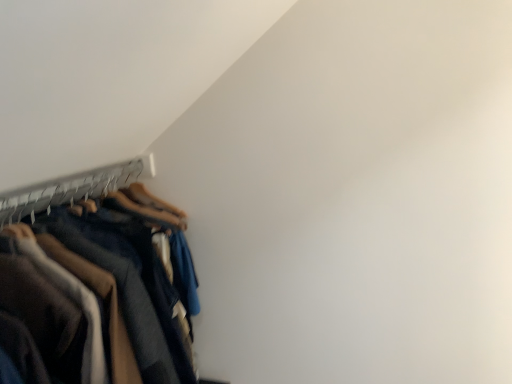
At what (x,y) coordinates should I click in order to perform the action: click on dark blue cotton trousers at left. Please return your answer as a coordinate pair (x, y). Looking at the image, I should click on (93, 303).

The height and width of the screenshot is (384, 512). What do you see at coordinates (93, 303) in the screenshot?
I see `dark blue cotton trousers at left` at bounding box center [93, 303].

What do you see at coordinates (70, 189) in the screenshot?
I see `wooden hanger at left` at bounding box center [70, 189].

Locate an element on the screen. wooden hanger at left is located at coordinates (70, 189).

The image size is (512, 384). What are the coordinates of `dark blue cotton trousers at left` in the screenshot? It's located at (93, 303).

Which is more to the right, wooden hanger at left or dark blue cotton trousers at left?

Positioned to the right is dark blue cotton trousers at left.

Is wooden hanger at left positioned before dark blue cotton trousers at left?

No, wooden hanger at left is further to the viewer.

Does point (79, 175) come closer to viewer compared to point (89, 226)?

No.

From the image's perspective, is wooden hanger at left located above dark blue cotton trousers at left?

Correct, wooden hanger at left appears higher than dark blue cotton trousers at left in the image.

From a real-world perspective, between wooden hanger at left and dark blue cotton trousers at left, who is vertically higher?

wooden hanger at left, from a real-world perspective.

Looking at their sizes, would you say wooden hanger at left is wider or thinner than dark blue cotton trousers at left?

Considering their sizes, wooden hanger at left looks slimmer than dark blue cotton trousers at left.

Who is shorter, wooden hanger at left or dark blue cotton trousers at left?

With less height is wooden hanger at left.

Which of these two, wooden hanger at left or dark blue cotton trousers at left, is smaller?

wooden hanger at left.

Is wooden hanger at left completely or partially outside of dark blue cotton trousers at left?

Actually, wooden hanger at left is at least partially inside dark blue cotton trousers at left.

Is wooden hanger at left far from dark blue cotton trousers at left?

wooden hanger at left is actually quite close to dark blue cotton trousers at left.

Is wooden hanger at left positioned with its back to dark blue cotton trousers at left?

Yes, wooden hanger at left is facing away from dark blue cotton trousers at left.

Where is `hanger behind the dark blue cotton trousers at left`? hanger behind the dark blue cotton trousers at left is located at coordinates (70, 189).

Considering the positions of objects dark blue cotton trousers at left and wooden hanger at left in the image provided, who is more to the right, dark blue cotton trousers at left or wooden hanger at left?

dark blue cotton trousers at left.

Which object is closer to the camera taking this photo, dark blue cotton trousers at left or wooden hanger at left?

dark blue cotton trousers at left is more forward.

Does point (195, 380) lie in front of point (58, 183)?

That is False.

From the image's perspective, is dark blue cotton trousers at left on wooden hanger at left?

No, from the image's perspective, dark blue cotton trousers at left is not on top of wooden hanger at left.

Consider the image. From a real-world perspective, is dark blue cotton trousers at left on wooden hanger at left?

No, from a real-world perspective, dark blue cotton trousers at left is not above wooden hanger at left.

Consider the image. Which object is wider, dark blue cotton trousers at left or wooden hanger at left?

With larger width is dark blue cotton trousers at left.

Considering the sizes of objects dark blue cotton trousers at left and wooden hanger at left in the image provided, who is shorter, dark blue cotton trousers at left or wooden hanger at left?

wooden hanger at left.

Can you confirm if dark blue cotton trousers at left is smaller than wooden hanger at left?

Actually, dark blue cotton trousers at left might be larger than wooden hanger at left.

Which is correct: dark blue cotton trousers at left is inside wooden hanger at left, or outside of it?

dark blue cotton trousers at left cannot be found inside wooden hanger at left.

Is dark blue cotton trousers at left directly adjacent to wooden hanger at left?

No, dark blue cotton trousers at left is not making contact with wooden hanger at left.

Is dark blue cotton trousers at left oriented towards wooden hanger at left?

No, dark blue cotton trousers at left is not aimed at wooden hanger at left.

What's the angular difference between dark blue cotton trousers at left and wooden hanger at left's facing directions?

2.67 degrees separate the facing orientations of dark blue cotton trousers at left and wooden hanger at left.

You are a GUI agent. You are given a task and a screenshot of the screen. Output one action in this format:
    pyautogui.click(x=<x>, y=<y>)
    Task: Click on the hanger above the dark blue cotton trousers at left (from a real-world perspective)
    Image resolution: width=512 pixels, height=384 pixels.
    Given the screenshot: What is the action you would take?
    pyautogui.click(x=70, y=189)

Where is `trousers on the right of wooden hanger at left`? Image resolution: width=512 pixels, height=384 pixels. trousers on the right of wooden hanger at left is located at coordinates (93, 303).

Identify the location of hanger that appears above the dark blue cotton trousers at left (from a real-world perspective). Image resolution: width=512 pixels, height=384 pixels. (70, 189).